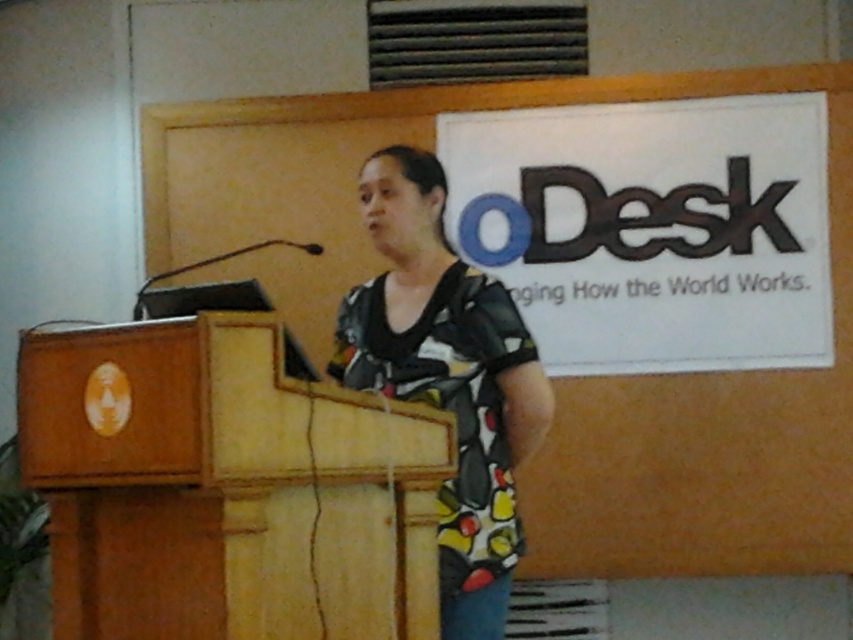
Does wooden podium at center appear on the left side of printed fabric blouse at center?

Yes, wooden podium at center is to the left of printed fabric blouse at center.

Does wooden podium at center lie in front of printed fabric blouse at center?

That is True.

Is point (184, 371) closer to camera compared to point (440, 499)?

That is True.

I want to click on wooden podium at center, so click(225, 486).